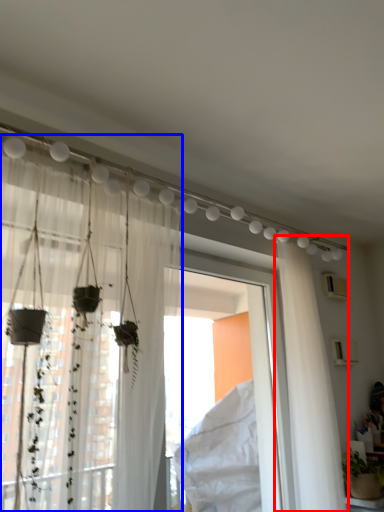
Question: Among these objects, which one is nearest to the camera, curtain (highlighted by a red box) or curtain (highlighted by a blue box)?

Choices:
 (A) curtain
 (B) curtain

Answer: (B)